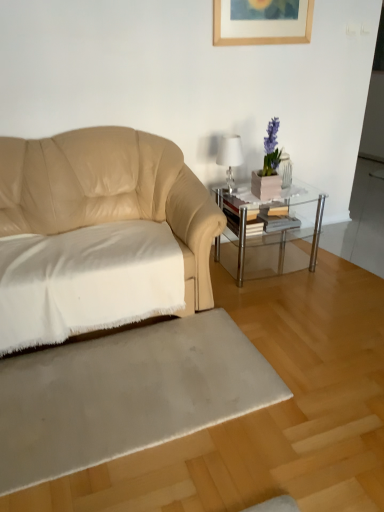
The image size is (384, 512). I want to click on vacant space to the right of clear glass table at center, so click(328, 260).